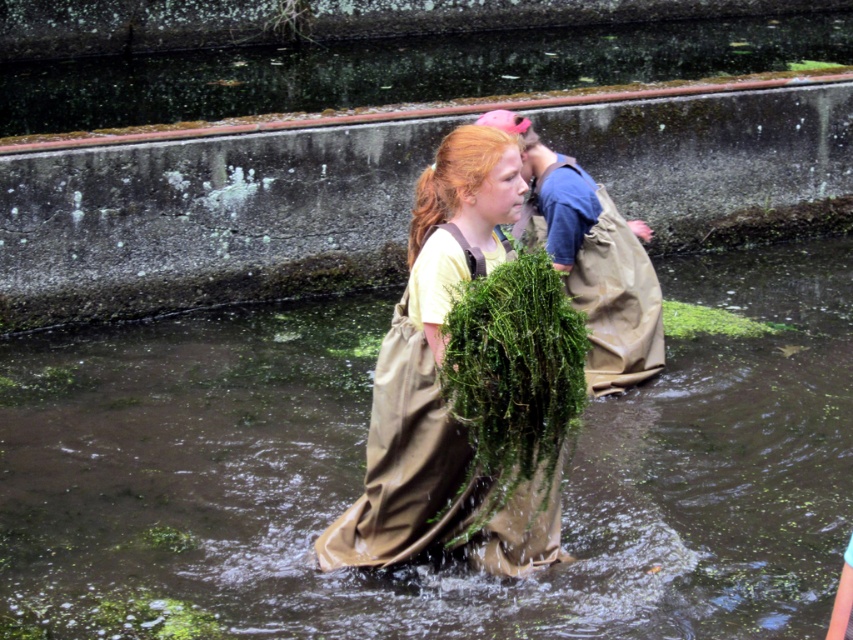
Does matte brown bag at center have a lesser width compared to green leafy algae at center?

Incorrect, matte brown bag at center's width is not less than green leafy algae at center's.

This screenshot has height=640, width=853. What do you see at coordinates (439, 387) in the screenshot?
I see `matte brown bag at center` at bounding box center [439, 387].

I want to click on matte brown bag at center, so click(439, 387).

Does green leafy algae at center come in front of green leafy plant at center?

Yes.

The image size is (853, 640). What do you see at coordinates (514, 372) in the screenshot?
I see `green leafy algae at center` at bounding box center [514, 372].

This screenshot has width=853, height=640. What are the coordinates of `green leafy algae at center` in the screenshot? It's located at (514, 372).

Does green mossy bundle at center have a greater height compared to green leafy algae at center?

Correct, green mossy bundle at center is much taller as green leafy algae at center.

Is green mossy bundle at center thinner than green leafy algae at center?

No.

Between point (383, 317) and point (486, 285), which one is positioned in front?

Positioned in front is point (486, 285).

At what (x,y) coordinates should I click in order to perform the action: click on green mossy bundle at center. Please return your answer as a coordinate pair (x, y). The height and width of the screenshot is (640, 853). Looking at the image, I should click on (363, 470).